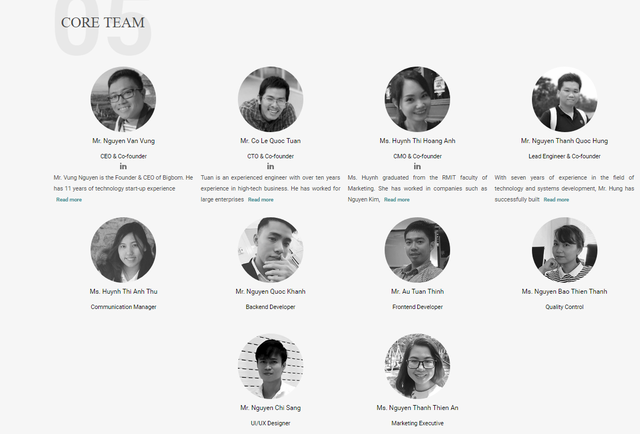
Find the location of a particular element. Image resolution: width=640 pixels, height=434 pixels. pictures is located at coordinates (120, 96), (422, 102), (252, 105), (554, 102), (553, 243), (418, 246), (276, 248), (118, 246), (420, 373).